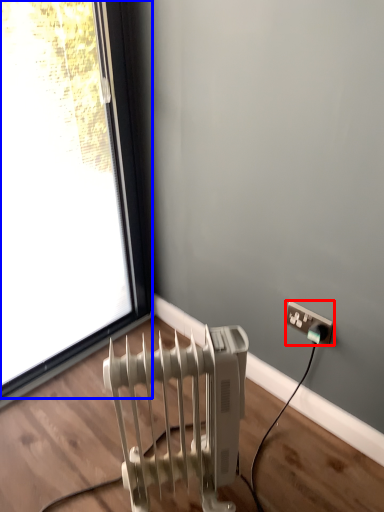
Question: Among these objects, which one is nearest to the camera, power plugs and sockets (highlighted by a red box) or window (highlighted by a blue box)?

Choices:
 (A) power plugs and sockets
 (B) window

Answer: (B)